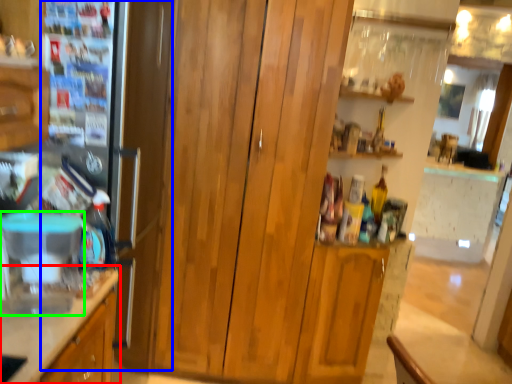
Question: Which object is the closest to the cabinetry (highlighted by a red box)? Choose among these: fridge (highlighted by a blue box) or appliance (highlighted by a green box).

Choices:
 (A) fridge
 (B) appliance

Answer: (B)